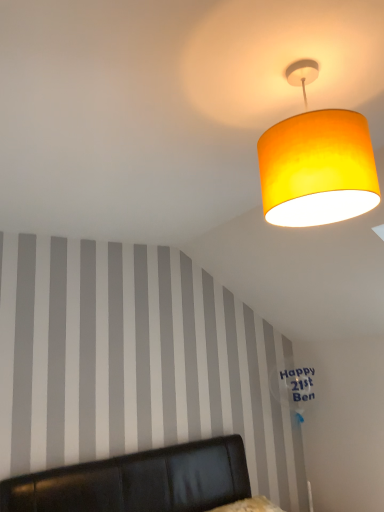
Question: Is point (185, 444) positioned closer to the camera than point (349, 181)?

Choices:
 (A) farther
 (B) closer

Answer: (A)

Question: From a real-world perspective, is black leather headboard at lower center physically located above or below matte yellow fabric lampshade at upper right?

Choices:
 (A) below
 (B) above

Answer: (A)

Question: Would you say black leather headboard at lower center is inside or outside matte yellow fabric lampshade at upper right?

Choices:
 (A) outside
 (B) inside

Answer: (A)

Question: Visually, is matte yellow fabric lampshade at upper right positioned to the left or to the right of black leather headboard at lower center?

Choices:
 (A) right
 (B) left

Answer: (A)

Question: From a real-world perspective, is matte yellow fabric lampshade at upper right above or below black leather headboard at lower center?

Choices:
 (A) above
 (B) below

Answer: (A)

Question: Considering the positions of point (327, 117) and point (105, 499), is point (327, 117) closer or farther from the camera than point (105, 499)?

Choices:
 (A) closer
 (B) farther

Answer: (A)

Question: Considering the positions of matte yellow fabric lampshade at upper right and black leather headboard at lower center in the image, is matte yellow fabric lampshade at upper right taller or shorter than black leather headboard at lower center?

Choices:
 (A) tall
 (B) short

Answer: (B)